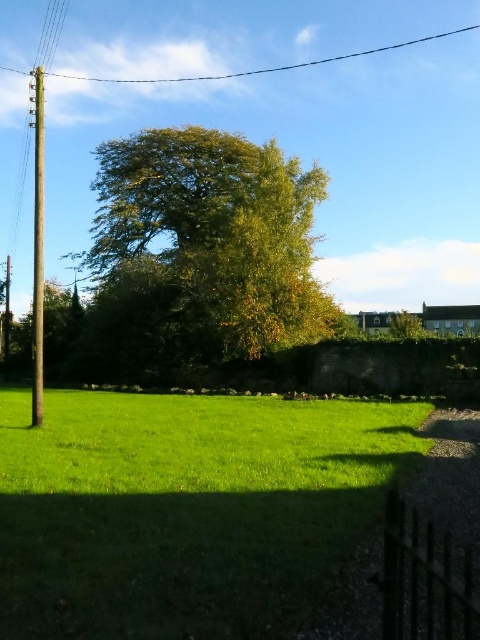
Who is lower down, green grass at lower left or metallic wire at upper center?

Positioned lower is green grass at lower left.

Is the position of green grass at lower left more distant than that of metallic wire at upper center?

No, it is not.

Is point (313, 422) closer to viewer compared to point (398, 42)?

Yes, point (313, 422) is in front of point (398, 42).

The height and width of the screenshot is (640, 480). Identify the location of green grass at lower left. (187, 509).

Is green leafy tree at center to the left of metallic wire at upper center from the viewer's perspective?

Yes, green leafy tree at center is to the left of metallic wire at upper center.

Between green leafy tree at center and metallic wire at upper center, which one appears on the left side from the viewer's perspective?

Positioned to the left is green leafy tree at center.

Is point (105, 346) in front of point (362, 54)?

That is True.

You are a GUI agent. You are given a task and a screenshot of the screen. Output one action in this format:
    pyautogui.click(x=<x>, y=<y>)
    Task: Click on the green leafy tree at center
    Image resolution: width=480 pixels, height=640 pixels.
    Given the screenshot: What is the action you would take?
    pyautogui.click(x=200, y=253)

From the picture: Is green grass at lower left below green leafy tree at center?

Correct, green grass at lower left is located below green leafy tree at center.

Who is shorter, green grass at lower left or green leafy tree at center?

green grass at lower left is shorter.

Describe the element at coordinates (187, 509) in the screenshot. The image size is (480, 640). I see `green grass at lower left` at that location.

The image size is (480, 640). I want to click on green grass at lower left, so click(187, 509).